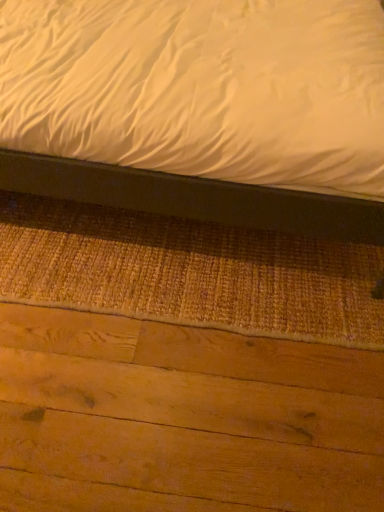
Question: From a real-world perspective, is matte black bed at upper center positioned above or below natural wood plywood at bottom?

Choices:
 (A) above
 (B) below

Answer: (A)

Question: From the image's perspective, is matte black bed at upper center located above or below natural wood plywood at bottom?

Choices:
 (A) below
 (B) above

Answer: (B)

Question: Considering their positions, is matte black bed at upper center located in front of or behind natural wood plywood at bottom?

Choices:
 (A) front
 (B) behind

Answer: (A)

Question: Is natural wood plywood at bottom spatially inside matte black bed at upper center, or outside of it?

Choices:
 (A) inside
 (B) outside

Answer: (B)

Question: Is natural wood plywood at bottom in front of or behind matte black bed at upper center in the image?

Choices:
 (A) front
 (B) behind

Answer: (B)

Question: From a real-world perspective, is natural wood plywood at bottom positioned above or below matte black bed at upper center?

Choices:
 (A) above
 (B) below

Answer: (B)

Question: From the image's perspective, is natural wood plywood at bottom located above or below matte black bed at upper center?

Choices:
 (A) below
 (B) above

Answer: (A)